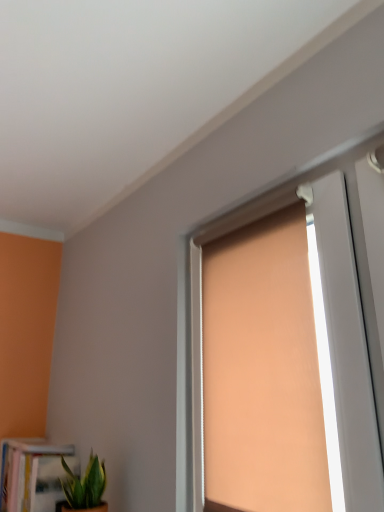
The width and height of the screenshot is (384, 512). I want to click on matte orange roller blind at center, so click(x=346, y=345).

Locate an element on the screen. This screenshot has height=512, width=384. white glossy bookcase at lower left is located at coordinates (33, 474).

Can white glossy bookcase at lower left be found inside green leafy plant at lower left?

No, white glossy bookcase at lower left is not surrounded by green leafy plant at lower left.

Based on the photo, what's the angular difference between green leafy plant at lower left and white glossy bookcase at lower left's facing directions?

1.11 degrees.

Is green leafy plant at lower left in front of white glossy bookcase at lower left?

Yes, green leafy plant at lower left is in front of white glossy bookcase at lower left.

Are green leafy plant at lower left and white glossy bookcase at lower left located far from each other?

green leafy plant at lower left is actually quite close to white glossy bookcase at lower left.

Is white glossy bookcase at lower left oriented towards matte orange roller blind at center?

No, white glossy bookcase at lower left does not turn towards matte orange roller blind at center.

From the image's perspective, is white glossy bookcase at lower left on matte orange roller blind at center?

No, from the image's perspective, white glossy bookcase at lower left is not above matte orange roller blind at center.

Locate an element on the screen. This screenshot has height=512, width=384. bookcase that appears below the matte orange roller blind at center (from the image's perspective) is located at coordinates (33, 474).

How much distance is there between green leafy plant at lower left and matte orange roller blind at center?

They are 21.17 inches apart.

Is green leafy plant at lower left with matte orange roller blind at center?

No, green leafy plant at lower left is not next to matte orange roller blind at center.

From a real-world perspective, is green leafy plant at lower left under matte orange roller blind at center?

Yes, from a real-world perspective, green leafy plant at lower left is below matte orange roller blind at center.

Locate an element on the screen. This screenshot has height=512, width=384. window that is on the right side of green leafy plant at lower left is located at coordinates (346, 345).

Is white glossy bookcase at lower left oriented away from green leafy plant at lower left?

white glossy bookcase at lower left is not turned away from green leafy plant at lower left.

Considering the sizes of white glossy bookcase at lower left and green leafy plant at lower left in the image, is white glossy bookcase at lower left wider or thinner than green leafy plant at lower left?

In the image, white glossy bookcase at lower left appears to be wider than green leafy plant at lower left.

I want to click on bookcase located above the green leafy plant at lower left (from a real-world perspective), so click(33, 474).

Can you confirm if white glossy bookcase at lower left is shorter than green leafy plant at lower left?

No, white glossy bookcase at lower left is not shorter than green leafy plant at lower left.

At what (x,y) coordinates should I click in order to perform the action: click on window lying in front of the white glossy bookcase at lower left. Please return your answer as a coordinate pair (x, y). Looking at the image, I should click on (346, 345).

Does matte orange roller blind at center have a lesser height compared to white glossy bookcase at lower left?

In fact, matte orange roller blind at center may be taller than white glossy bookcase at lower left.

In the scene shown: Does matte orange roller blind at center lie in front of white glossy bookcase at lower left?

Yes.

Is matte orange roller blind at center smaller than green leafy plant at lower left?

No.

Considering the positions of points (322, 241) and (79, 498), is point (322, 241) closer to camera compared to point (79, 498)?

Yes, it is in front of point (79, 498).

Is matte orange roller blind at center far from green leafy plant at lower left?

No.

Between matte orange roller blind at center and green leafy plant at lower left, which one appears on the left side from the viewer's perspective?

Positioned to the left is green leafy plant at lower left.

You are a GUI agent. You are given a task and a screenshot of the screen. Output one action in this format:
    pyautogui.click(x=<x>, y=<y>)
    Task: Click on the bookcase that appears above the green leafy plant at lower left (from a real-world perspective)
    The image size is (384, 512).
    Given the screenshot: What is the action you would take?
    pyautogui.click(x=33, y=474)

At what (x,y) coordinates should I click in order to perform the action: click on window that appears in front of the white glossy bookcase at lower left. Please return your answer as a coordinate pair (x, y). The width and height of the screenshot is (384, 512). Looking at the image, I should click on (346, 345).

Estimate the real-world distances between objects in this image. Which object is further from green leafy plant at lower left, white glossy bookcase at lower left or matte orange roller blind at center?

Among the two, matte orange roller blind at center is located further to green leafy plant at lower left.

Based on their spatial positions, is green leafy plant at lower left or matte orange roller blind at center closer to white glossy bookcase at lower left?

green leafy plant at lower left is closer to white glossy bookcase at lower left.

When comparing their distances from green leafy plant at lower left, does matte orange roller blind at center or white glossy bookcase at lower left seem further?

matte orange roller blind at center is further to green leafy plant at lower left.

From the image, which object appears to be nearer to white glossy bookcase at lower left, matte orange roller blind at center or green leafy plant at lower left?

Based on the image, green leafy plant at lower left appears to be nearer to white glossy bookcase at lower left.

When comparing their distances from matte orange roller blind at center, does white glossy bookcase at lower left or green leafy plant at lower left seem further?

Among the two, white glossy bookcase at lower left is located further to matte orange roller blind at center.

Looking at the image, which one is located further to matte orange roller blind at center, green leafy plant at lower left or white glossy bookcase at lower left?

The object further to matte orange roller blind at center is white glossy bookcase at lower left.

The width and height of the screenshot is (384, 512). Identify the location of houseplant between white glossy bookcase at lower left and matte orange roller blind at center in the horizontal direction. coord(84,487).